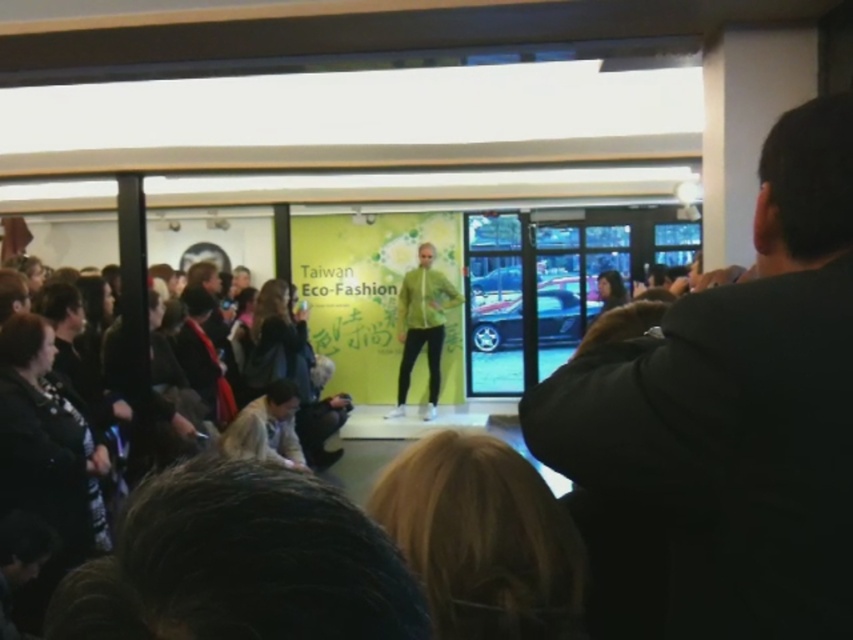
You are a photographer standing at the back of the room. You want to take a closeup photo of the black jacket at right. The camera you have can focus on objects up to 30 inches away. Can you take the photo without moving closer?

The black jacket at right is 34.60 inches away from the viewer. Since the camera can only focus up to 30 inches, you cannot take the closeup photo without moving closer.

In the scene of the Taiwan Eco Fashion event, there is a black jacket at right and a point marked at coordinates (726, 426). Can you determine if the point is located on the black jacket at right?

The point at coordinates (726, 426) corresponds to the black jacket at right, so yes, the point is located on the black jacket at right.

You are a photographer at the Taiwan Eco Fashion event. You need to capture a photo that includes both the black jacket at right and the green matte jacket at center. Which jacket should you position to the left side in your camera frame to ensure both are visible?

The black jacket at right is positioned on the right side of the green matte jacket at center. To include both in the photo, you should position the green matte jacket at center to the left side in your camera frame so that the black jacket at right naturally falls to its right within the frame.